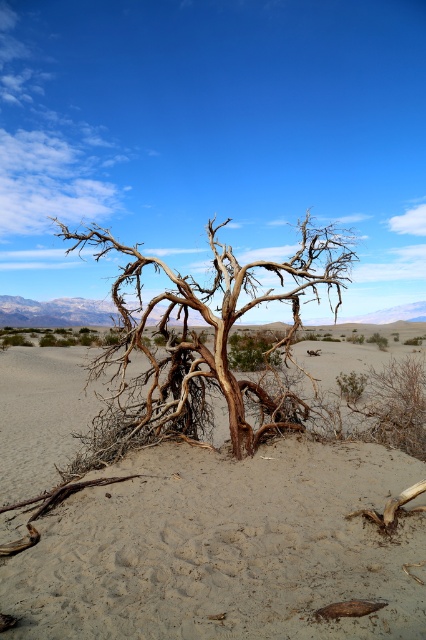
Question: Which object appears closest to the camera in this image?

Choices:
 (A) brown sandy soil at center
 (B) brown textured tree at center

Answer: (A)

Question: Which point is closer to the camera?

Choices:
 (A) (71, 598)
 (B) (345, 269)

Answer: (A)

Question: Is brown sandy soil at center smaller than brown textured tree at center?

Choices:
 (A) yes
 (B) no

Answer: (A)

Question: Which point is closer to the camera taking this photo?

Choices:
 (A) click(x=118, y=280)
 (B) click(x=14, y=593)

Answer: (B)

Question: Can you confirm if brown sandy soil at center is positioned to the right of brown textured tree at center?

Choices:
 (A) yes
 (B) no

Answer: (B)

Question: Is brown sandy soil at center positioned at the back of brown textured tree at center?

Choices:
 (A) no
 (B) yes

Answer: (A)